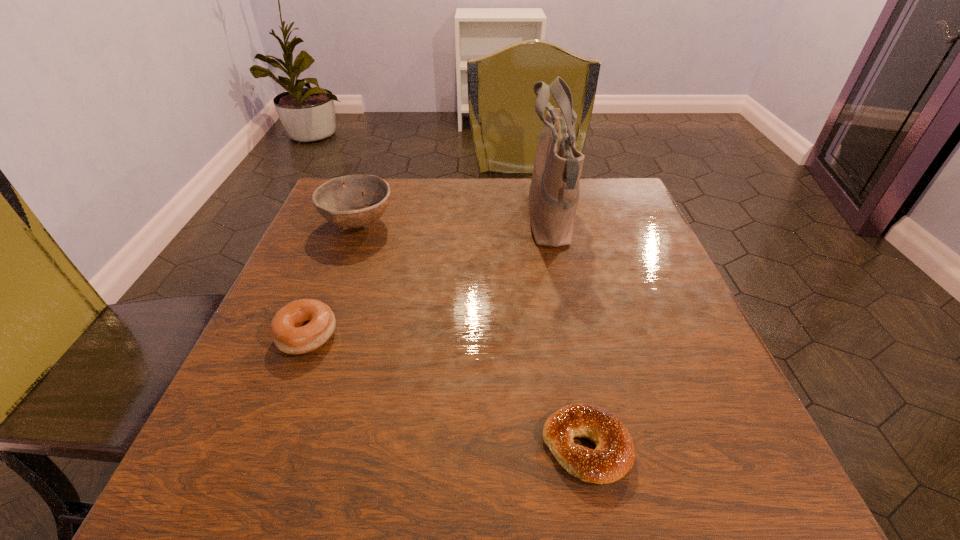
You are a GUI agent. You are given a task and a screenshot of the screen. Output one action in this format:
    pyautogui.click(x=<x>, y=<y>)
    Task: Click on the vacant point at the left edge
    Image resolution: width=960 pixels, height=540 pixels.
    Given the screenshot: What is the action you would take?
    [316, 252]

The image size is (960, 540). In the image, there is a desktop. Identify the location of vacant region at the right edge. (732, 442).

Locate an element on the screen. free location at the far right corner is located at coordinates (594, 205).

Find the location of a particular element. Image resolution: width=960 pixels, height=540 pixels. free space between the tallest object and the left bagel is located at coordinates (428, 279).

I want to click on free spot between the third shortest object and the farther bagel, so click(x=333, y=279).

What are the coordinates of `free space between the shoulder bag and the nearest object` in the screenshot? It's located at (568, 334).

You are a GUI agent. You are given a task and a screenshot of the screen. Output one action in this format:
    pyautogui.click(x=<x>, y=<y>)
    Task: Click on the vacant space that is in between the shorter bagel and the second tallest object
    This screenshot has height=540, width=960.
    Given the screenshot: What is the action you would take?
    pyautogui.click(x=472, y=335)

Identify the location of empty space between the nearest object and the shoulder bag. (568, 334).

The width and height of the screenshot is (960, 540). What are the coordinates of `empty space that is in between the nearer bagel and the third shortest object` in the screenshot? It's located at (472, 335).

What are the coordinates of `free space that is in between the second shortest object and the second tallest object` in the screenshot? It's located at (333, 279).